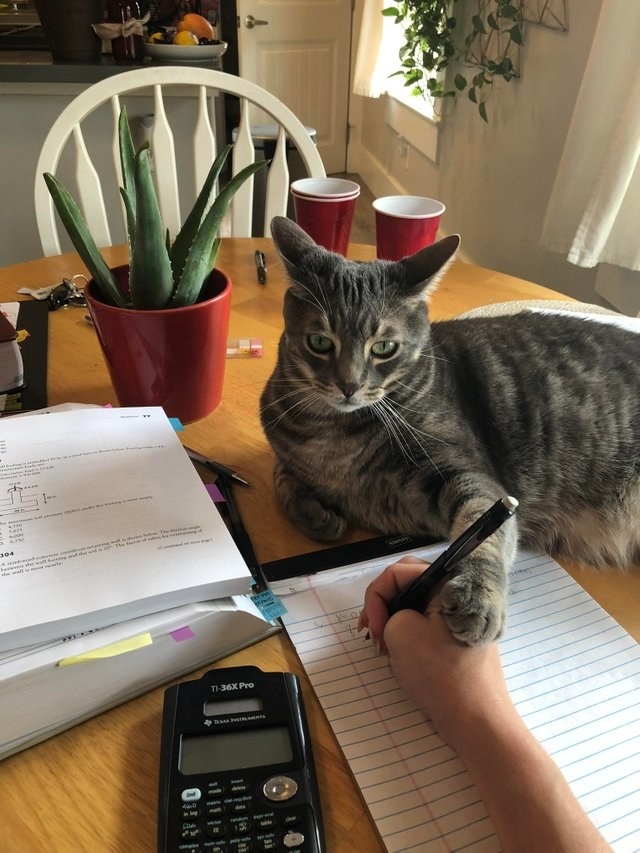
Where is `screen`? Image resolution: width=640 pixels, height=853 pixels. screen is located at coordinates (249, 749), (226, 706).